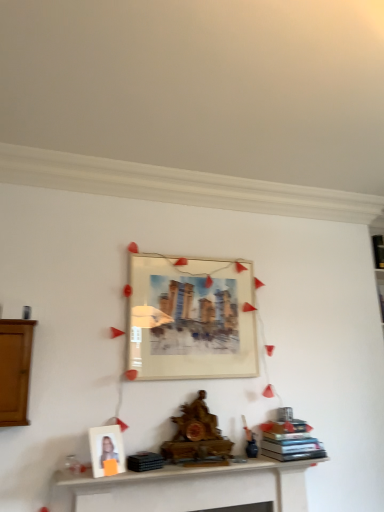
Describe the element at coordinates (124, 327) in the screenshot. I see `matte paper picture frame at center` at that location.

Locate an element on the screen. white matte picture frame at lower left, the second picture frame viewed from the right is located at coordinates (106, 448).

The width and height of the screenshot is (384, 512). I want to click on matte white picture frame at center, which ranks as the first picture frame in right-to-left order, so click(191, 318).

In order to face brown wooden cabinet at left, should I rotate leftwards or rightwards?

Rotate left and turn 22.550 degrees.

Where is `black matte book at upper right, marked as the 2th book in a left-to-right arrangement`? The height and width of the screenshot is (512, 384). black matte book at upper right, marked as the 2th book in a left-to-right arrangement is located at coordinates (378, 250).

Considering the positions of objects matte white picture frame at center, marked as the 2th picture frame in a left-to-right arrangement, and hardcover books at center, which ranks as the 2th book in top-to-bottom order, in the image provided, who is more to the right, matte white picture frame at center, marked as the 2th picture frame in a left-to-right arrangement, or hardcover books at center, which ranks as the 2th book in top-to-bottom order,?

hardcover books at center, which ranks as the 2th book in top-to-bottom order.

From the image's perspective, between matte white picture frame at center, arranged as the first picture frame when viewed from the back, and hardcover books at center, which ranks as the 2th book in top-to-bottom order, which one is located above?

matte white picture frame at center, arranged as the first picture frame when viewed from the back, appears higher in the image.

From a real-world perspective, which is physically above, matte white picture frame at center, marked as the 2th picture frame in a left-to-right arrangement, or hardcover books at center, which ranks as the 2th book in top-to-bottom order?

In real-world perspective, matte white picture frame at center, marked as the 2th picture frame in a left-to-right arrangement, is above.

Is matte white picture frame at center, arranged as the first picture frame when viewed from the back, next to hardcover books at center, marked as the first book in a bottom-to-top arrangement, and touching it?

matte white picture frame at center, arranged as the first picture frame when viewed from the back, and hardcover books at center, marked as the first book in a bottom-to-top arrangement, are not in contact.

This screenshot has width=384, height=512. Identify the location of shelf below the wooden statue at center (from a real-world perspective). (191, 487).

Is wooden statue at center facing towards white wooden shelf at lower center?

No, wooden statue at center does not turn towards white wooden shelf at lower center.

Is wooden statue at center taller than white wooden shelf at lower center?

Yes.

Is wooden statue at center situated inside white wooden shelf at lower center or outside?

wooden statue at center is outside white wooden shelf at lower center.

Is white matte picture frame at lower left, arranged as the first picture frame when ordered from the bottom, at the back of matte paper picture frame at center?

Yes, white matte picture frame at lower left, arranged as the first picture frame when ordered from the bottom, is at the back of matte paper picture frame at center.

Which object is positioned more to the right, matte paper picture frame at center or white matte picture frame at lower left, which ranks as the 2th picture frame in back-to-front order?

matte paper picture frame at center is more to the right.

Does matte paper picture frame at center have a lesser width compared to white matte picture frame at lower left, placed as the first picture frame when sorted from left to right?

In fact, matte paper picture frame at center might be wider than white matte picture frame at lower left, placed as the first picture frame when sorted from left to right.

Locate an element on the screen. The height and width of the screenshot is (512, 384). picture frame that appears on the left of matte paper picture frame at center is located at coordinates (106, 448).

Which is behind, wooden statue at center or white matte picture frame at lower left, which appears as the 2th picture frame when viewed from the top?

wooden statue at center is further from the camera.

From the image's perspective, which object appears higher, wooden statue at center or white matte picture frame at lower left, which ranks as the 2th picture frame in back-to-front order?

wooden statue at center, from the image's perspective.

Is white matte picture frame at lower left, the second picture frame viewed from the right, at the back of wooden statue at center?

wooden statue at center is not turned away from white matte picture frame at lower left, the second picture frame viewed from the right.

Looking at the image, does wooden statue at center seem bigger or smaller compared to white matte picture frame at lower left, which appears as the 2th picture frame when viewed from the top?

Considering their sizes, wooden statue at center takes up more space than white matte picture frame at lower left, which appears as the 2th picture frame when viewed from the top.

Considering the relative sizes of hardcover books at center, which is counted as the first book, starting from the front, and white wooden shelf at lower center in the image provided, is hardcover books at center, which is counted as the first book, starting from the front, bigger than white wooden shelf at lower center?

Incorrect, hardcover books at center, which is counted as the first book, starting from the front, is not larger than white wooden shelf at lower center.

Consider the image. Does hardcover books at center, which is counted as the first book, starting from the front, contain white wooden shelf at lower center?

Actually, white wooden shelf at lower center is outside hardcover books at center, which is counted as the first book, starting from the front.

Image resolution: width=384 pixels, height=512 pixels. What are the coordinates of `shelf to the left of hardcover books at center, marked as the first book in a bottom-to-top arrangement` in the screenshot? It's located at (191, 487).

Is wooden statue at center located within white wooden shelf at lower center?

No, wooden statue at center is not a part of white wooden shelf at lower center.

Are white wooden shelf at lower center and wooden statue at center far apart?

No, white wooden shelf at lower center is in close proximity to wooden statue at center.

From the image's perspective, is black matte book at upper right, the 2th book from the bottom, above or below brown wooden cabinet at left?

Clearly, from the image's perspective, black matte book at upper right, the 2th book from the bottom, is above brown wooden cabinet at left.

Looking at their sizes, would you say black matte book at upper right, the 2th book from the bottom, is wider or thinner than brown wooden cabinet at left?

Clearly, black matte book at upper right, the 2th book from the bottom, has less width compared to brown wooden cabinet at left.

Looking at this image, from a real-world perspective, is black matte book at upper right, the second book when ordered from front to back, above or below brown wooden cabinet at left?

black matte book at upper right, the second book when ordered from front to back, is situated higher than brown wooden cabinet at left in the real world.

Is black matte book at upper right, the second book when ordered from front to back, positioned far away from brown wooden cabinet at left?

black matte book at upper right, the second book when ordered from front to back, is far away from brown wooden cabinet at left.

Find the location of a particular element. This screenshot has width=384, height=512. book that is the 1st one when counting rightward from the matte white picture frame at center, the second picture frame positioned from the bottom is located at coordinates (289, 441).

Where is `shelf directly beneath the wooden statue at center (from a real-world perspective)`? shelf directly beneath the wooden statue at center (from a real-world perspective) is located at coordinates (191, 487).

Which object lies nearer to the anchor point black matte book at upper right, marked as the 2th book in a left-to-right arrangement, wooden statue at center or matte paper picture frame at center?

Among the two, matte paper picture frame at center is located nearer to black matte book at upper right, marked as the 2th book in a left-to-right arrangement.

Which object lies further to the anchor point white wooden shelf at lower center, matte paper picture frame at center or black matte book at upper right, the first book viewed from the back?

black matte book at upper right, the first book viewed from the back, lies further to white wooden shelf at lower center than the other object.

Which object lies nearer to the anchor point matte paper picture frame at center, wooden statue at center or black matte book at upper right, which appears as the first book when viewed from the top?

Based on the image, wooden statue at center appears to be nearer to matte paper picture frame at center.

From the image, which object appears to be nearer to brown wooden cabinet at left, white matte picture frame at lower left, arranged as the first picture frame when ordered from the bottom, or hardcover books at center, which is counted as the first book, starting from the front?

Based on the image, white matte picture frame at lower left, arranged as the first picture frame when ordered from the bottom, appears to be nearer to brown wooden cabinet at left.

Considering their positions, is white wooden shelf at lower center positioned further to wooden statue at center than black matte book at upper right, the first book viewed from the back?

The object further to wooden statue at center is black matte book at upper right, the first book viewed from the back.

When comparing their distances from white matte picture frame at lower left, which ranks as the 2th picture frame in back-to-front order, does matte paper picture frame at center or wooden statue at center seem further?

matte paper picture frame at center is further to white matte picture frame at lower left, which ranks as the 2th picture frame in back-to-front order.

Estimate the real-world distances between objects in this image. Which object is further from matte paper picture frame at center, brown wooden cabinet at left or white matte picture frame at lower left, arranged as the first picture frame when ordered from the bottom?

white matte picture frame at lower left, arranged as the first picture frame when ordered from the bottom, lies further to matte paper picture frame at center than the other object.

From the picture: Looking at the image, which one is located further to hardcover books at center, which ranks as the 2th book in back-to-front order, brown wooden cabinet at left or white matte picture frame at lower left, which appears as the 2th picture frame when viewed from the top?

brown wooden cabinet at left is further to hardcover books at center, which ranks as the 2th book in back-to-front order.

This screenshot has height=512, width=384. Find the location of `book between brown wooden cabinet at left and black matte book at upper right, the second book when ordered from front to back, from left to right`. book between brown wooden cabinet at left and black matte book at upper right, the second book when ordered from front to back, from left to right is located at coordinates (289, 441).

I want to click on book situated between matte white picture frame at center, arranged as the first picture frame when viewed from the back, and black matte book at upper right, the 2th book from the bottom, from left to right, so click(289, 441).

What are the coordinates of `fireplace between matte paper picture frame at center and hardcover books at center, which is the second book in right-to-left order, in the horizontal direction` in the screenshot? It's located at (196, 435).

This screenshot has width=384, height=512. Identify the location of shelf situated between wooden statue at center and black matte book at upper right, the second book when ordered from front to back, from left to right. (191, 487).